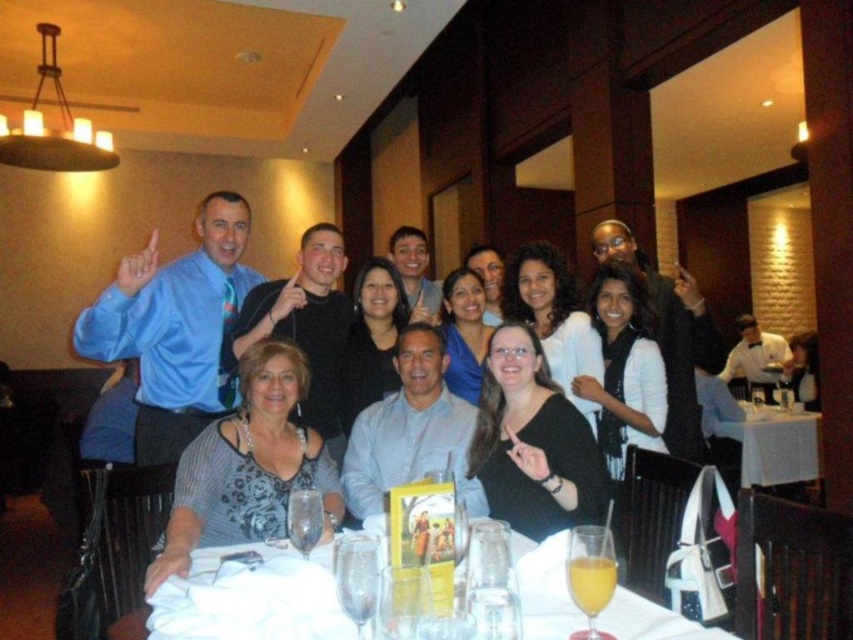
Does white paper napkin at lower center have a lesser width compared to striped fabric dress at center?

In fact, white paper napkin at lower center might be wider than striped fabric dress at center.

At what (x,y) coordinates should I click in order to perform the action: click on white paper napkin at lower center. Please return your answer as a coordinate pair (x, y). The image size is (853, 640). Looking at the image, I should click on (251, 598).

Where is `white paper napkin at lower center`? The image size is (853, 640). white paper napkin at lower center is located at coordinates (251, 598).

Is black matte shirt at center positioned behind white tablecloth at center?

No, it is in front of white tablecloth at center.

Between point (570, 432) and point (804, 481), which one is positioned in front?

Point (570, 432) is more forward.

Is point (561, 461) closer to viewer compared to point (798, 428)?

That is True.

Find the location of a particular element. This screenshot has width=853, height=640. black matte shirt at center is located at coordinates (532, 442).

Is white paper napkin at lower center positioned before black matte shirt at center?

Yes, it is.

Is white paper napkin at lower center positioned behind black matte shirt at center?

No, it is not.

Image resolution: width=853 pixels, height=640 pixels. Identify the location of white paper napkin at lower center. 251,598.